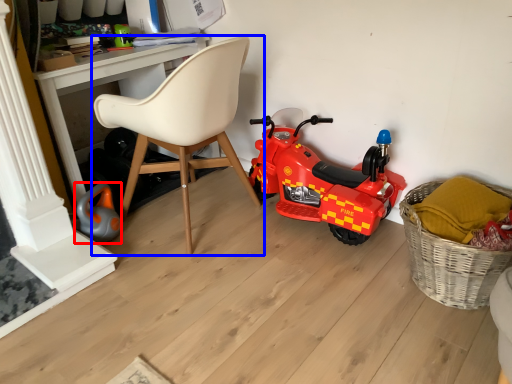
Question: Among these objects, which one is farthest to the camera, toy (highlighted by a red box) or chair (highlighted by a blue box)?

Choices:
 (A) toy
 (B) chair

Answer: (A)